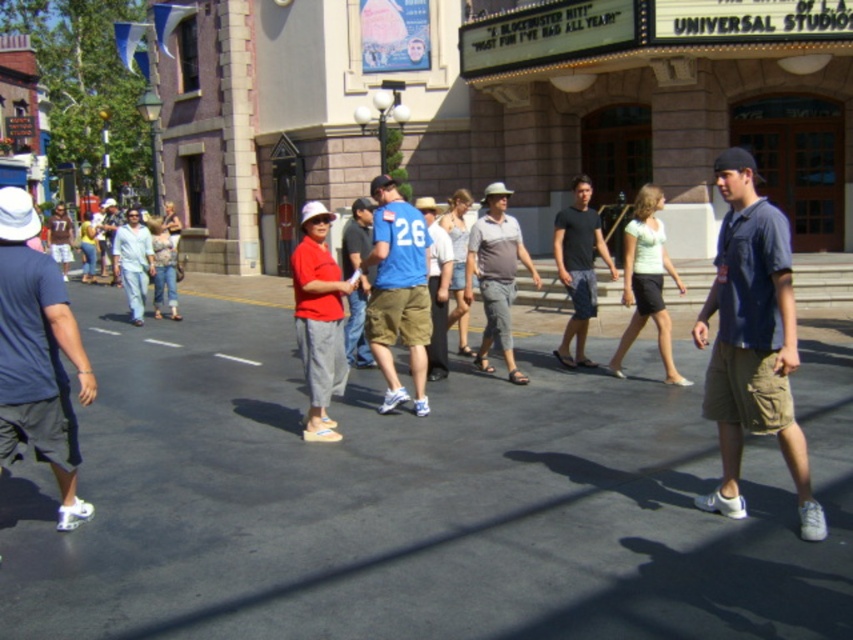
Which of these two, black cotton shirt at center or blue jersey at center, stands shorter?

blue jersey at center

Which is more to the left, black cotton shirt at center or blue jersey at center?

From the viewer's perspective, blue jersey at center appears more on the left side.

The width and height of the screenshot is (853, 640). In order to click on black cotton shirt at center in this screenshot , I will do `click(578, 268)`.

Between blue fabric shirt at center and light blue jeans at center, which one has more height?

blue fabric shirt at center

Can you confirm if blue fabric shirt at center is smaller than light blue jeans at center?

No, blue fabric shirt at center is not smaller than light blue jeans at center.

Does point (424, 317) come behind point (160, 304)?

No, it is not.

Where is `blue fabric shirt at center`? blue fabric shirt at center is located at coordinates (398, 292).

Does dark blue t-shirt at left have a lesser height compared to black cotton shirt at center?

Indeed, dark blue t-shirt at left has a lesser height compared to black cotton shirt at center.

Who is positioned more to the right, dark blue t-shirt at left or black cotton shirt at center?

Positioned to the right is black cotton shirt at center.

Who is more forward, (42, 451) or (552, 244)?

Point (42, 451) is in front.

Where is `dark blue t-shirt at left`? The image size is (853, 640). dark blue t-shirt at left is located at coordinates (38, 356).